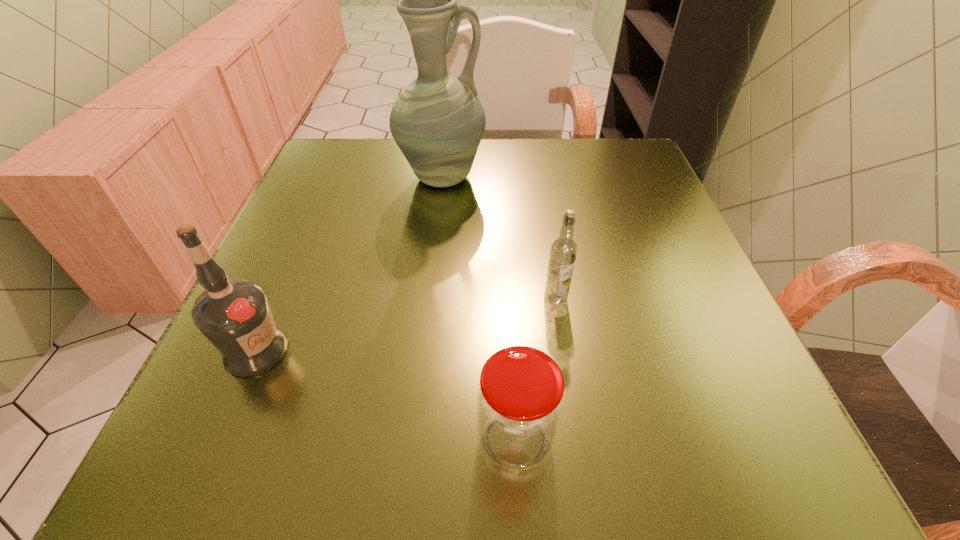
At what (x,y) coordinates should I click in order to perform the action: click on blank space located on the label of the farther vodka. Please return your answer as a coordinate pair (x, y). The image size is (960, 540). Looking at the image, I should click on (564, 355).

Identify the location of vacant area situated 0.120m on the right of the shortest object. The image size is (960, 540). (648, 439).

Find the location of a particular element. This screenshot has height=540, width=960. object that is positioned at the far edge is located at coordinates (437, 121).

Where is `object that is at the near edge`? The width and height of the screenshot is (960, 540). object that is at the near edge is located at coordinates (520, 397).

What are the coordinates of `object that is positioned at the left edge` in the screenshot? It's located at (234, 315).

In order to click on blank space at the far edge in this screenshot , I will do `click(525, 179)`.

Find the location of a particular element. This screenshot has height=540, width=960. vacant space at the near edge of the desktop is located at coordinates 501,478.

In order to click on blank space at the left edge in this screenshot , I will do `click(214, 394)`.

In order to click on free space at the right edge of the desktop in this screenshot , I will do `click(673, 242)`.

In the image, there is a desktop. Where is `free space at the far left corner`? free space at the far left corner is located at coordinates (377, 167).